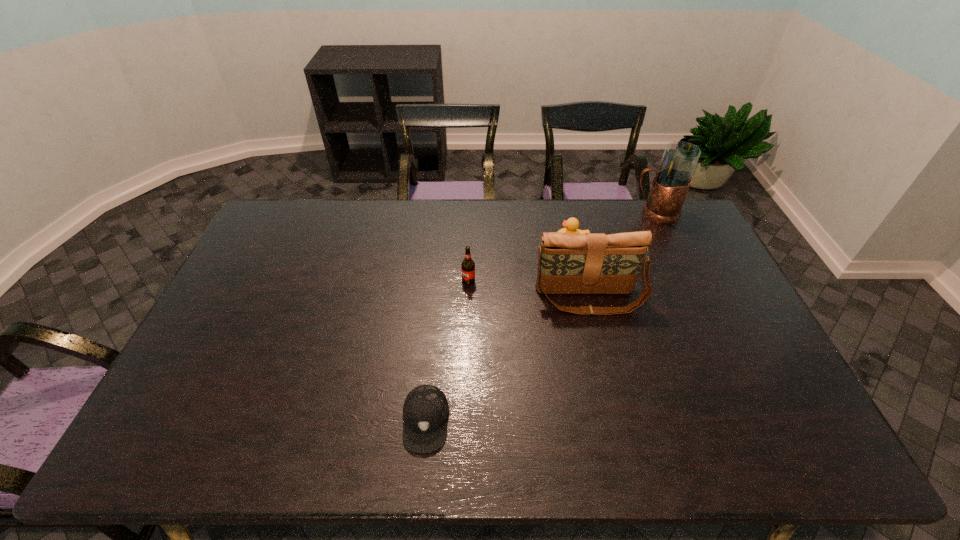
The image size is (960, 540). What are the coordinates of `free space between the third tallest object and the shoulder bag` in the screenshot? It's located at tap(528, 289).

The image size is (960, 540). In order to click on free space between the leftmost object and the fourth nearest object in this screenshot , I will do `click(498, 332)`.

This screenshot has width=960, height=540. What are the coordinates of `free spot between the second object from left to right and the cap` in the screenshot? It's located at (447, 350).

This screenshot has width=960, height=540. Find the location of `object that is the third nearest to the root beer`. object that is the third nearest to the root beer is located at coordinates (425, 411).

Choose which object is the fourth nearest neighbor to the shoulder bag. Please provide its 2D coordinates. Your answer should be formatted as a tuple, i.e. [(x, y)], where the tuple contains the x and y coordinates of a point satisfying the conditions above.

[(425, 411)]

Where is `free point that satisfies the following two spatial constraints: 1. on the face of the second shortest object; 2. on the front-facing side of the leftmost object`? free point that satisfies the following two spatial constraints: 1. on the face of the second shortest object; 2. on the front-facing side of the leftmost object is located at coordinates (612, 421).

This screenshot has width=960, height=540. I want to click on vacant region that satisfies the following two spatial constraints: 1. with the handle on the side of the pitcher; 2. on the front-facing side of the leftmost object, so click(x=753, y=421).

The width and height of the screenshot is (960, 540). Find the location of `blank space that satisfies the following two spatial constraints: 1. with the handle on the side of the rightmost object; 2. on the front-facing side of the shoulder bag`. blank space that satisfies the following two spatial constraints: 1. with the handle on the side of the rightmost object; 2. on the front-facing side of the shoulder bag is located at coordinates (695, 299).